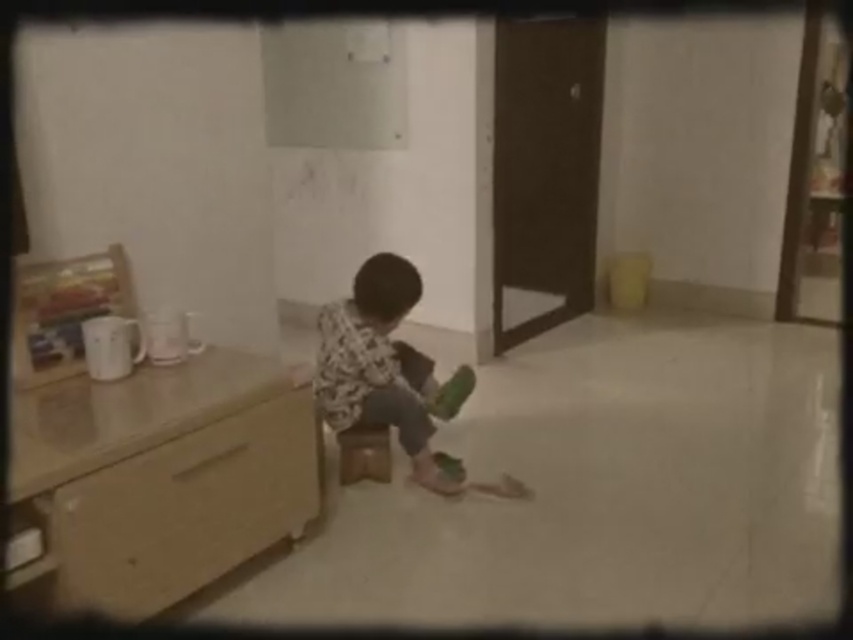
From the picture: You are a parent trying to reach the wooden drawer at lower left to get a toy for your child. The brown wooden stool at center is in your way. Can you step onto the stool to reach the drawer?

The wooden drawer at lower left has a greater height compared to the brown wooden stool at center. Since the stool is shorter than the drawer, stepping onto it may help you reach the drawer, but you might still need to stretch or adjust your position depending on the exact height difference.

You are a parent trying to organize the living room. You have a wooden drawer at lower left and a brown wooden stool at center. Which object should you move if you want to free up more space?

You should move the wooden drawer at lower left because it is larger in size than the brown wooden stool at center, freeing up more space.